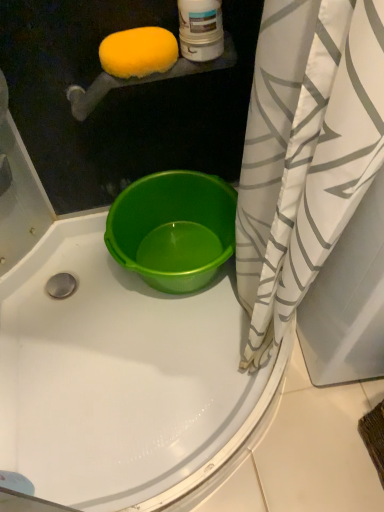
Question: In terms of width, does green plastic bucket at center look wider or thinner when compared to white/gray striped shower curtain at right?

Choices:
 (A) wide
 (B) thin

Answer: (B)

Question: Would you say green plastic bucket at center is to the left or to the right of white/gray striped shower curtain at right in the picture?

Choices:
 (A) left
 (B) right

Answer: (A)

Question: Which of these objects is positioned farthest from the white/gray striped shower curtain at right?

Choices:
 (A) yellow sponge at upper left
 (B) green plastic bucket at center

Answer: (A)

Question: Which object is positioned closest to the green plastic bucket at center?

Choices:
 (A) white/gray striped shower curtain at right
 (B) yellow sponge at upper left

Answer: (A)